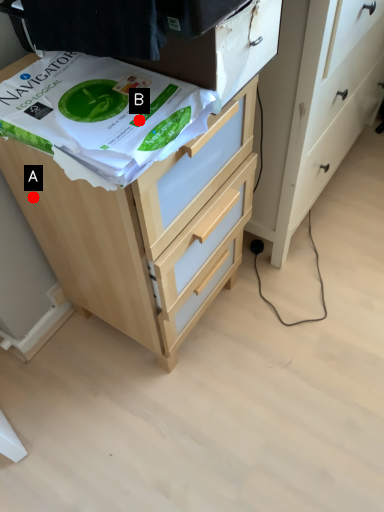
Question: Two points are circled on the image, labeled by A and B beside each circle. Which point is closer to the camera taking this photo?

Choices:
 (A) A is closer
 (B) B is closer

Answer: (B)